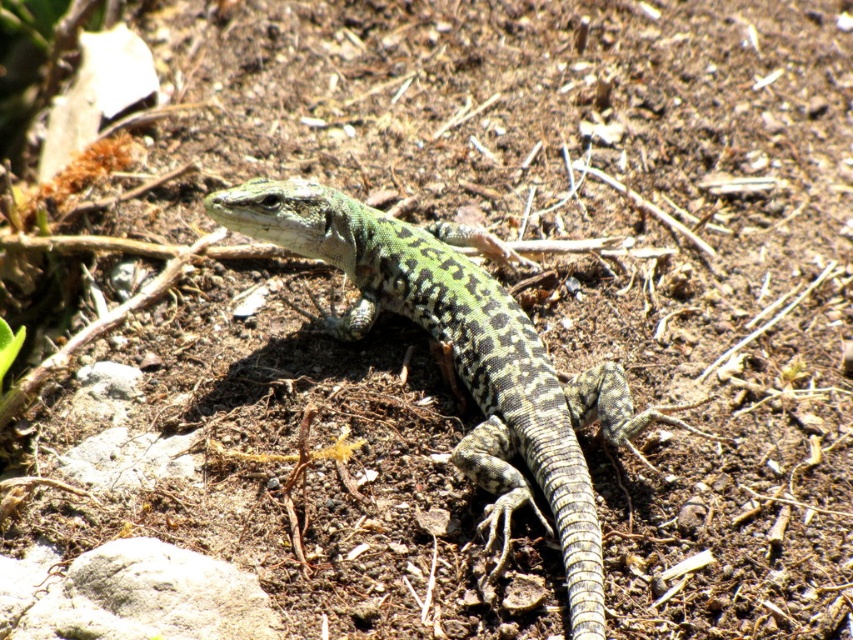
Based on the photo, you are a wildlife photographer trying to capture the green scaly lizard at center and the gray rough rock at lower left in the same frame. Based on their sizes, which object will appear bigger in your photo?

The green scaly lizard at center will appear bigger in the photo since it has a larger size compared to the gray rough rock at lower left.

You are a hiker who wants to take a photo of the green scaly lizard at center and the gray rough rock at lower left. Which object is closer to the camera?

The green scaly lizard at center is above the gray rough rock at lower left, so it is closer to the camera.